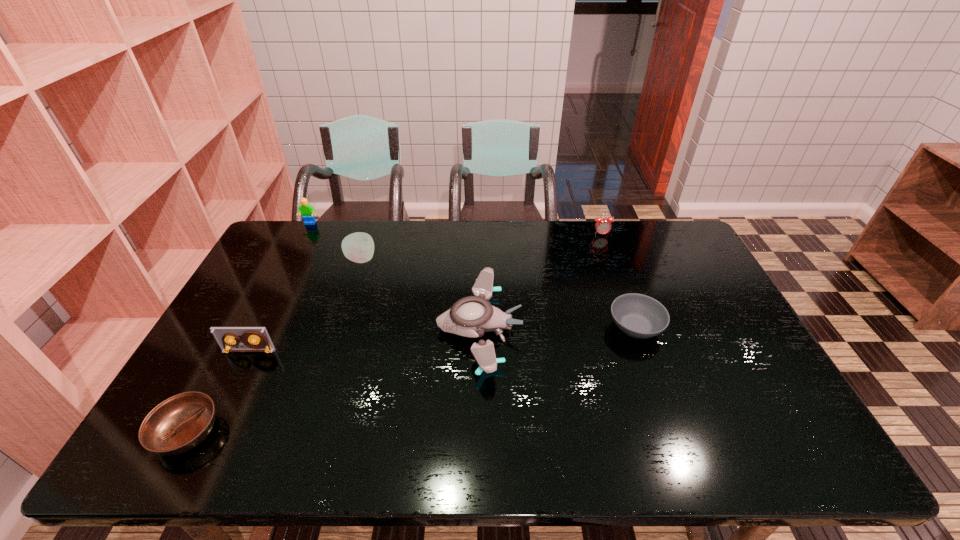
Locate an element on the screen. Image resolution: width=960 pixels, height=540 pixels. vacant space that satisfies the following two spatial constraints: 1. on the back side of the right soup bowl; 2. on the left side of the left soup bowl is located at coordinates (244, 327).

Locate an element on the screen. The image size is (960, 540). vacant space that satisfies the following two spatial constraints: 1. on the face of the farthest object; 2. on the left side of the fifth nearest object is located at coordinates (292, 259).